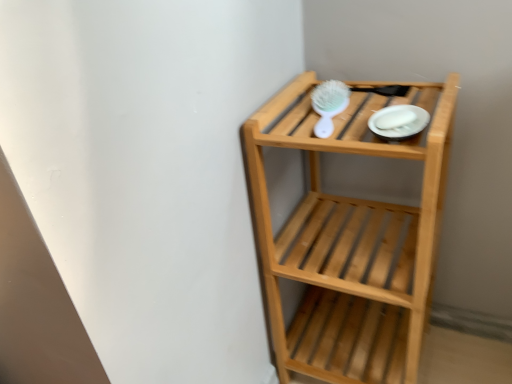
Question: From the image's perspective, relative to white plastic brush at upper center, is natural wood shelf at upper right above or below?

Choices:
 (A) below
 (B) above

Answer: (A)

Question: Is natural wood shelf at upper right taller or shorter than white plastic brush at upper center?

Choices:
 (A) short
 (B) tall

Answer: (B)

Question: Estimate the real-world distances between objects in this image. Which object is closer to the white glossy plate at upper right?

Choices:
 (A) natural wood shelf at upper right
 (B) white plastic brush at upper center

Answer: (B)

Question: Based on their relative distances, which object is farther from the white plastic brush at upper center?

Choices:
 (A) white glossy plate at upper right
 (B) natural wood shelf at upper right

Answer: (B)